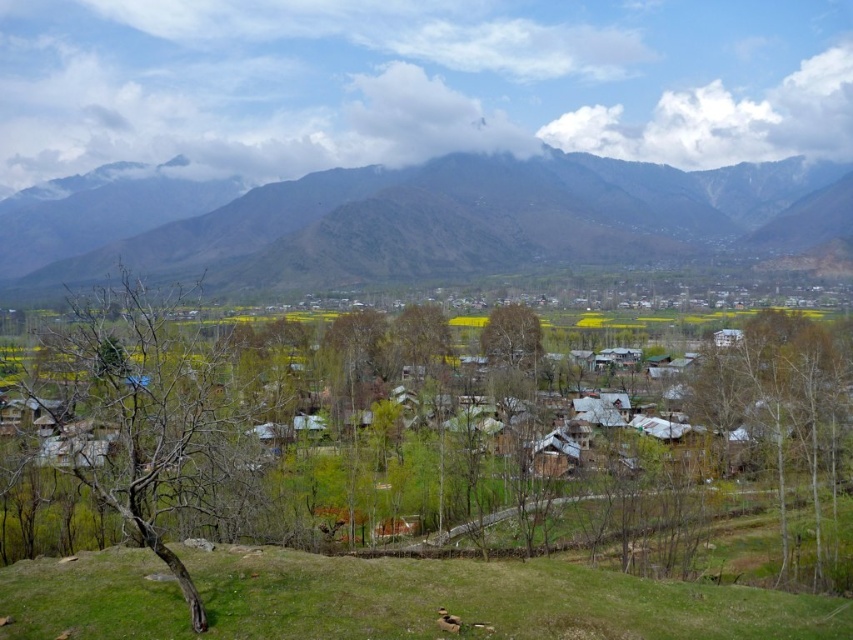
Is brown leafless tree at center-left to the right of green grassy hillside at lower center from the viewer's perspective?

No, brown leafless tree at center-left is not to the right of green grassy hillside at lower center.

Can you confirm if brown leafless tree at center-left is taller than green grassy hillside at lower center?

Yes.

Is point (358, 604) less distant than point (325, 609)?

No, (358, 604) is behind (325, 609).

This screenshot has height=640, width=853. In order to click on brown leafless tree at center-left in this screenshot , I will do `click(167, 419)`.

How distant is brown leafless tree at center-left from bare wood tree at left?

A distance of 5.41 meters exists between brown leafless tree at center-left and bare wood tree at left.

Which of these two, brown leafless tree at center-left or bare wood tree at left, stands taller?

With more height is brown leafless tree at center-left.

Find the location of `brown leafless tree at center-left`. brown leafless tree at center-left is located at coordinates (167, 419).

Between bare wood tree at left and bare wood tree at right, which one is positioned higher?

bare wood tree at left

Does bare wood tree at left come in front of bare wood tree at right?

That is True.

Between point (170, 374) and point (820, 333), which one is positioned behind?

The point (820, 333) is behind.

Where is `bare wood tree at left`? This screenshot has width=853, height=640. bare wood tree at left is located at coordinates (154, 417).